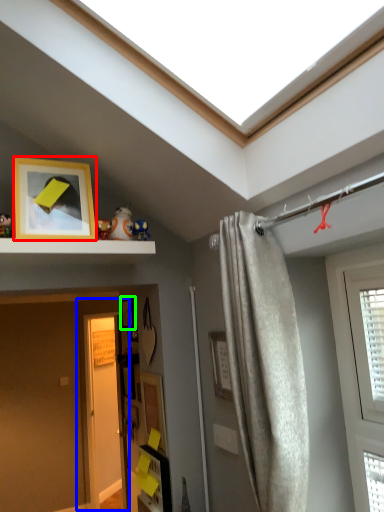
Question: Estimate the real-world distances between objects in this image. Which object is farther from picture frame (highlighted by a red box), door (highlighted by a blue box) or picture frame (highlighted by a green box)?

Choices:
 (A) door
 (B) picture frame

Answer: (A)